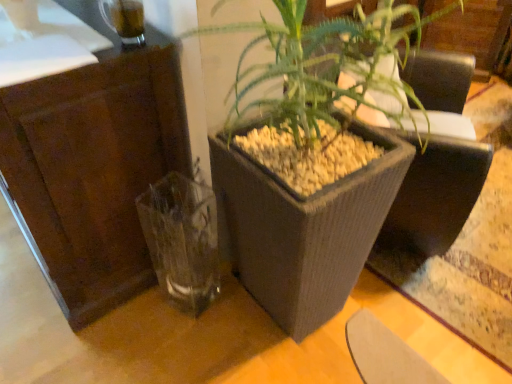
In order to face transparent glass vase at lower left, should I rotate leftwards or rightwards?

Rotate left and turn 10.772 degrees.

Measure the distance between point [164,226] and camera.

The distance of point [164,226] from camera is 4.13 feet.

The width and height of the screenshot is (512, 384). I want to click on matte gray planter at center, so click(x=310, y=149).

Which is farther, (28, 89) or (178, 180)?

The point (178, 180) is more distant.

Based on the photo, do you think brown wood dresser at left is within transparent glass vase at lower left, or outside of it?

The correct answer is: outside.

Is brown wood dresser at left not close to transparent glass vase at lower left?

They are positioned close to each other.

From the image's perspective, is matte gray planter at center below transparent glass vase at lower left?

No.

Does matte gray planter at center have a greater width compared to transparent glass vase at lower left?

Indeed, matte gray planter at center has a greater width compared to transparent glass vase at lower left.

The width and height of the screenshot is (512, 384). In the image, there is a matte gray planter at center. In order to click on vase below it (from the image's perspective) in this screenshot , I will do `click(182, 239)`.

From a real-world perspective, which object stands above the other?

matte gray planter at center, from a real-world perspective.

Are matte gray planter at center and brown wood dresser at left far apart?

That's not correct — matte gray planter at center is a little close to brown wood dresser at left.

Which object is positioned more to the right, matte gray planter at center or brown wood dresser at left?

matte gray planter at center is more to the right.

Locate an element on the screen. This screenshot has width=512, height=384. houseplant below the brown wood dresser at left (from the image's perspective) is located at coordinates (310, 149).

Is point (300, 26) closer or farther from the camera than point (42, 207)?

Clearly, point (300, 26) is closer to the camera than point (42, 207).

Can you confirm if transparent glass vase at lower left is positioned to the right of brown wood dresser at left?

Correct, you'll find transparent glass vase at lower left to the right of brown wood dresser at left.

Do you think transparent glass vase at lower left is within brown wood dresser at left, or outside of it?

transparent glass vase at lower left is located beyond the bounds of brown wood dresser at left.

Is the depth of transparent glass vase at lower left greater than that of brown wood dresser at left?

Yes.

Does transparent glass vase at lower left have a lesser width compared to matte gray planter at center?

Yes.

Is transparent glass vase at lower left next to matte gray planter at center and touching it?

No, transparent glass vase at lower left is not with matte gray planter at center.

Can matte gray planter at center be found inside transparent glass vase at lower left?

No, matte gray planter at center is not inside transparent glass vase at lower left.

From the image's perspective, is transparent glass vase at lower left below matte gray planter at center?

Yes, from the image's perspective, transparent glass vase at lower left is beneath matte gray planter at center.

In the scene shown: Would you consider brown wood dresser at left to be distant from matte gray planter at center?

Actually, brown wood dresser at left and matte gray planter at center are a little close together.

In order to click on dresser on the left of matte gray planter at center in this screenshot , I will do `click(93, 169)`.

I want to click on vase below the brown wood dresser at left (from a real-world perspective), so click(182, 239).

Locate an element on the screen. This screenshot has height=384, width=512. houseplant on the right of transparent glass vase at lower left is located at coordinates (310, 149).

From the image, which object appears to be farther from brown wood dresser at left, matte gray planter at center or transparent glass vase at lower left?

Among the two, matte gray planter at center is located further to brown wood dresser at left.

From the picture: Considering their positions, is transparent glass vase at lower left positioned further to matte gray planter at center than brown wood dresser at left?

Among the two, brown wood dresser at left is located further to matte gray planter at center.

Estimate the real-world distances between objects in this image. Which object is closer to matte gray planter at center, brown wood dresser at left or transparent glass vase at lower left?

transparent glass vase at lower left is closer to matte gray planter at center.

Based on their spatial positions, is transparent glass vase at lower left or matte gray planter at center further from brown wood dresser at left?

matte gray planter at center is further to brown wood dresser at left.

Estimate the real-world distances between objects in this image. Which object is closer to transparent glass vase at lower left, matte gray planter at center or brown wood dresser at left?

brown wood dresser at left lies closer to transparent glass vase at lower left than the other object.

Looking at the image, which one is located closer to transparent glass vase at lower left, brown wood dresser at left or matte gray planter at center?

Among the two, brown wood dresser at left is located nearer to transparent glass vase at lower left.

I want to click on vase between brown wood dresser at left and matte gray planter at center in the horizontal direction, so click(182, 239).